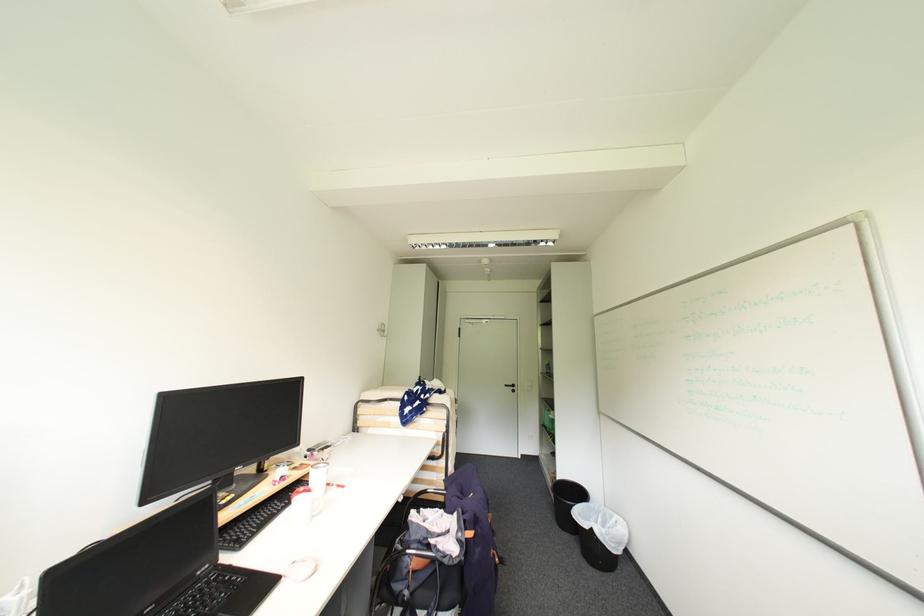
At what (x,y) coordinates should I click in order to perform the action: click on black door handle. Please return your answer as a coordinate pair (x, y). The height and width of the screenshot is (616, 924). Looking at the image, I should click on (512, 387).